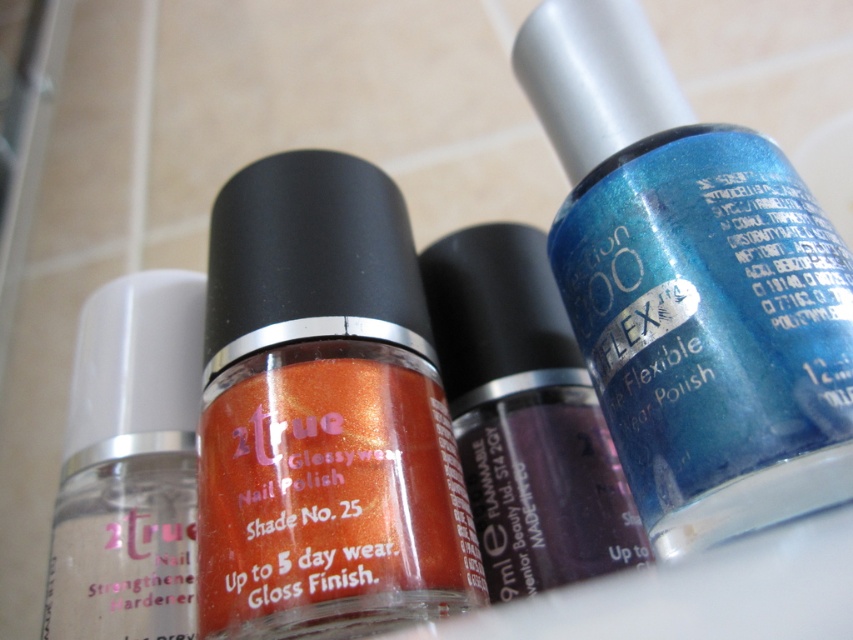
You are organizing nail polish bottles on a narrow shelf. The shiny purple nail polish at center and the transparent matte nail strengthener at left need to be placed side by side. Given their widths, which one should you place first to ensure they fit without overlapping?

The transparent matte nail strengthener at left is narrower than the shiny purple nail polish at center. Place the narrower transparent matte nail strengthener at left first, then the wider shiny purple nail polish at center to fit them side by side without overlapping.

You are organizing nail polish bottles on a shelf and need to place the shiny blue nail polish at center and the shiny purple nail polish at center in order of size from largest to smallest. Which one should you place first?

The shiny blue nail polish at center should be placed first since it is larger than the shiny purple nail polish at center.

You are a customer looking at the nail polish bottles arranged on the countertop. There are two points marked on the bottles. The first point is at coordinates point (467, 576) and the second is at point (64, 445). Which of these points is closer to you?

Point (467, 576) is closer to the viewer than point (64, 445).